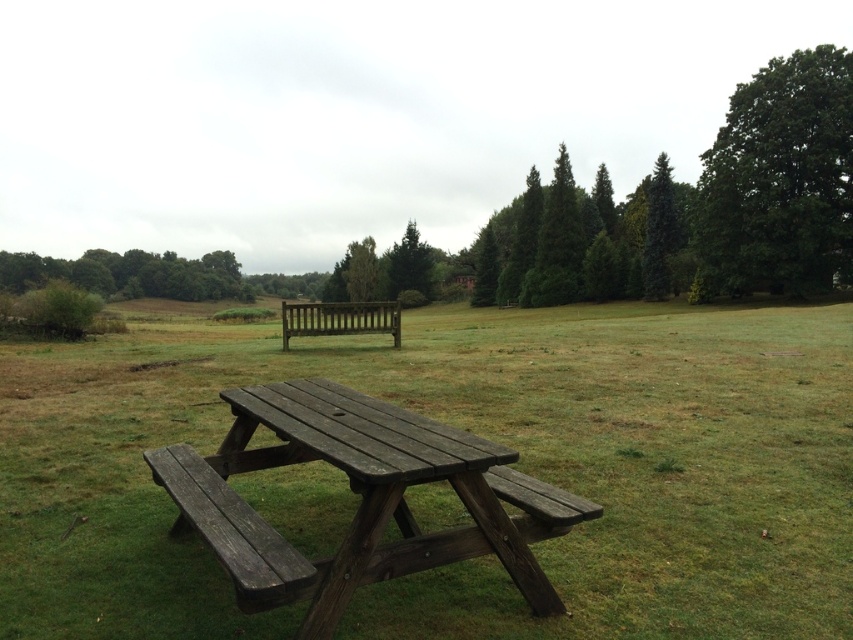
Question: Which of these objects is positioned farthest from the green matte tree at upper right?

Choices:
 (A) green textured trees at upper center
 (B) dark brown wood picnic table at lower center
 (C) green textured tree at upper center
 (D) weathered wood bench at lower left

Answer: (D)

Question: Can you confirm if green leafy tree at upper right is thinner than green textured tree at upper center?

Choices:
 (A) no
 (B) yes

Answer: (A)

Question: Which point is farther to the camera?

Choices:
 (A) (294, 406)
 (B) (428, 291)
 (C) (672, 198)

Answer: (B)

Question: Is brown wooden picnic table at center below dark brown wood picnic table at lower center?

Choices:
 (A) yes
 (B) no

Answer: (B)

Question: Which of the following is the farthest from the observer?

Choices:
 (A) (650, 220)
 (B) (57, 412)

Answer: (A)

Question: Is dark brown wood picnic table at lower center positioned at the back of green textured trees at upper center?

Choices:
 (A) no
 (B) yes

Answer: (A)